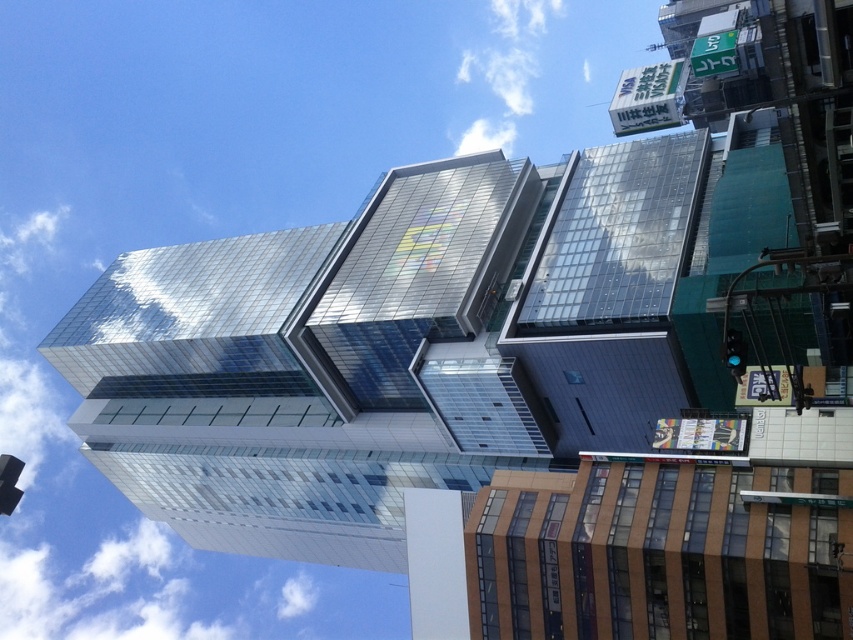
How much distance is there between black glass traffic light at lower left and green glass traffic light at right?

They are 135.81 feet apart.

Between black glass traffic light at lower left and green glass traffic light at right, which one appears on the right side from the viewer's perspective?

From the viewer's perspective, green glass traffic light at right appears more on the right side.

Where is `black glass traffic light at lower left`? black glass traffic light at lower left is located at coordinates (9, 483).

Where is `black glass traffic light at lower left`? The height and width of the screenshot is (640, 853). black glass traffic light at lower left is located at coordinates (9, 483).